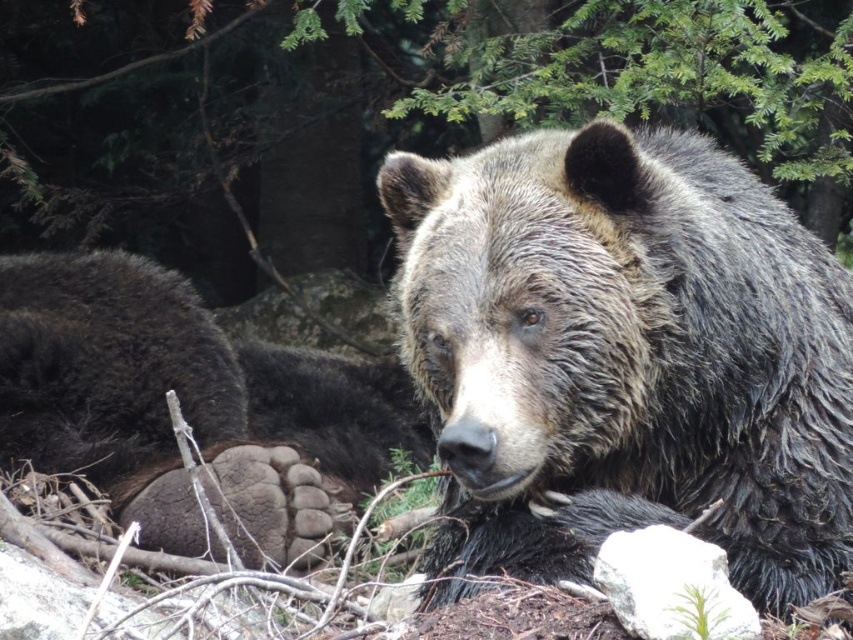
Question: Can you confirm if brown fur bear at center is positioned above brown fur paw at center?

Choices:
 (A) no
 (B) yes

Answer: (B)

Question: Is brown fur bear at center above brown fur paw at center?

Choices:
 (A) yes
 (B) no

Answer: (A)

Question: From the image, what is the correct spatial relationship of brown fur bear at center in relation to brown fur paw at center?

Choices:
 (A) below
 (B) above

Answer: (B)

Question: Which point is farther to the camera?

Choices:
 (A) brown fur bear at center
 (B) brown fur paw at center

Answer: (B)